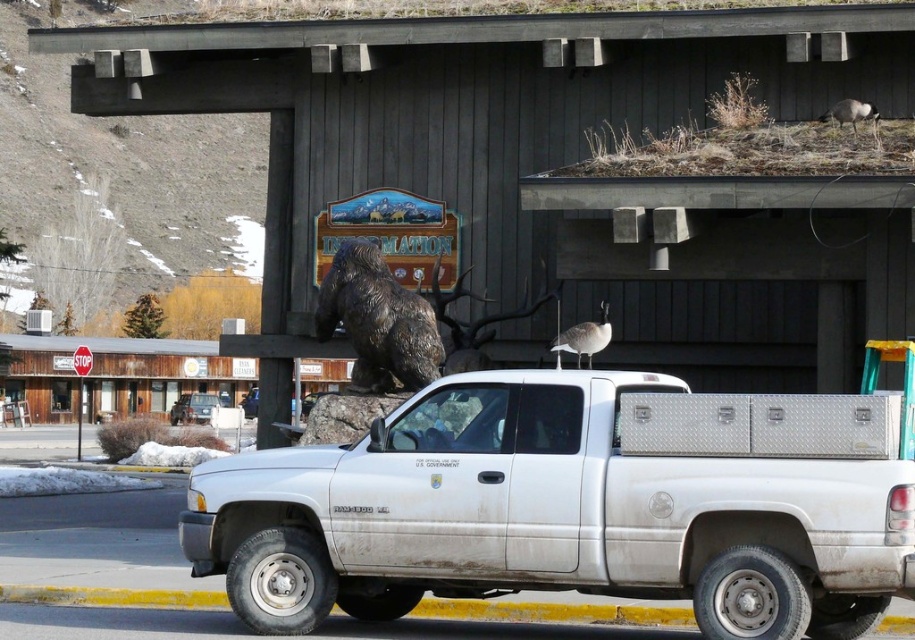
You are a tour guide leading a group to the bronze statue at center. A child in your group asks if the gray feathered goose at upper center is close enough to touch the statue. Based on the scene, what do you tell them?

The bronze statue at center and the gray feathered goose at upper center are 2.88 meters apart from each other, so the goose is too far to touch the statue.

You are standing at the entrance of the information center and want to take a photo of the bronze statue at center. Where should you position yourself to capture the statue in the frame?

The bronze statue at center is located at the central point of the image, so positioning yourself directly in front of it would ensure it is centered in your photo.